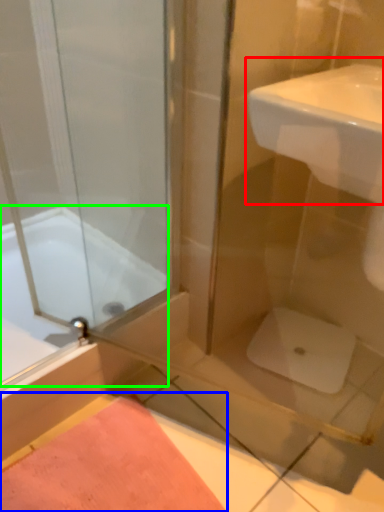
Question: Which is farther away from sink (highlighted by a red box)? bath mat (highlighted by a blue box) or bathtub (highlighted by a green box)?

Choices:
 (A) bath mat
 (B) bathtub

Answer: (A)